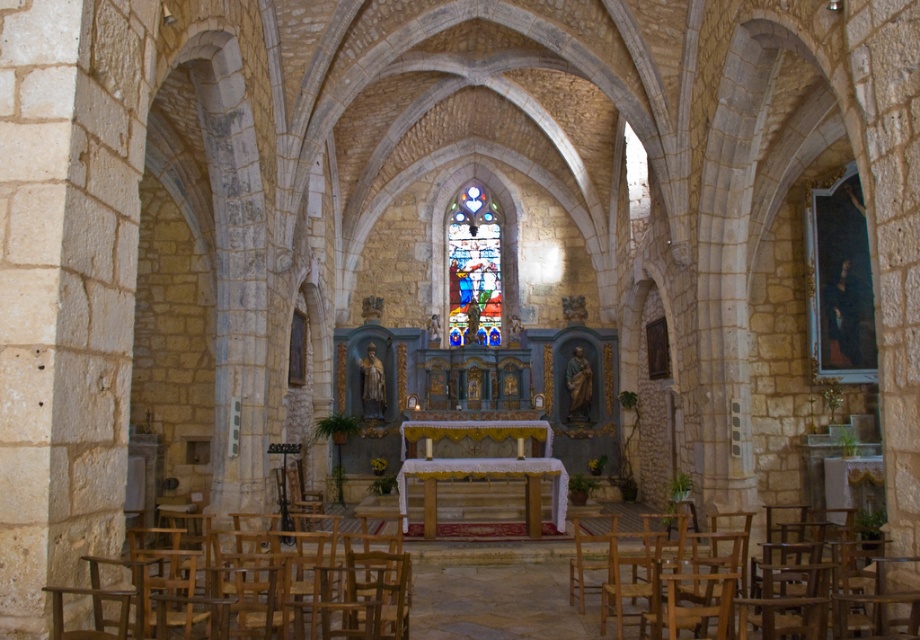
Question: Can you confirm if wooden chair at lower left is positioned to the right of stained glass window at center?

Choices:
 (A) no
 (B) yes

Answer: (A)

Question: Is wooden chair at lower left thinner than light brown wood chair at lower center?

Choices:
 (A) no
 (B) yes

Answer: (A)

Question: Which point is farther to the camera?

Choices:
 (A) (474, 323)
 (B) (853, 625)
 (C) (251, 582)

Answer: (A)

Question: Estimate the real-world distances between objects in this image. Which object is farther from the wooden chair at lower left?

Choices:
 (A) stained glass window at center
 (B) light brown wood chair at lower center

Answer: (A)

Question: Estimate the real-world distances between objects in this image. Which object is farther from the light brown wood chair at lower center?

Choices:
 (A) stained glass window at center
 (B) wooden chair at lower left

Answer: (A)

Question: Can you confirm if wooden chair at lower left is smaller than stained glass window at center?

Choices:
 (A) no
 (B) yes

Answer: (A)